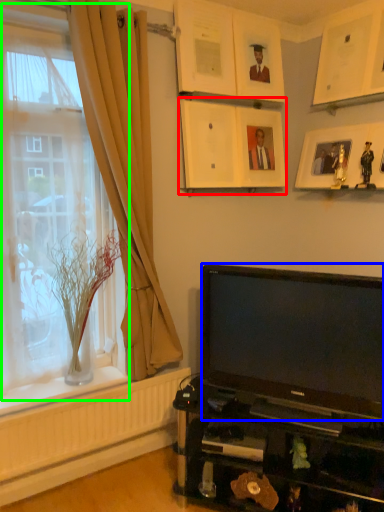
Question: Based on their relative distances, which object is nearer to picture frame (highlighted by a red box)? Choose from television (highlighted by a blue box) and window (highlighted by a green box).

Choices:
 (A) television
 (B) window

Answer: (B)